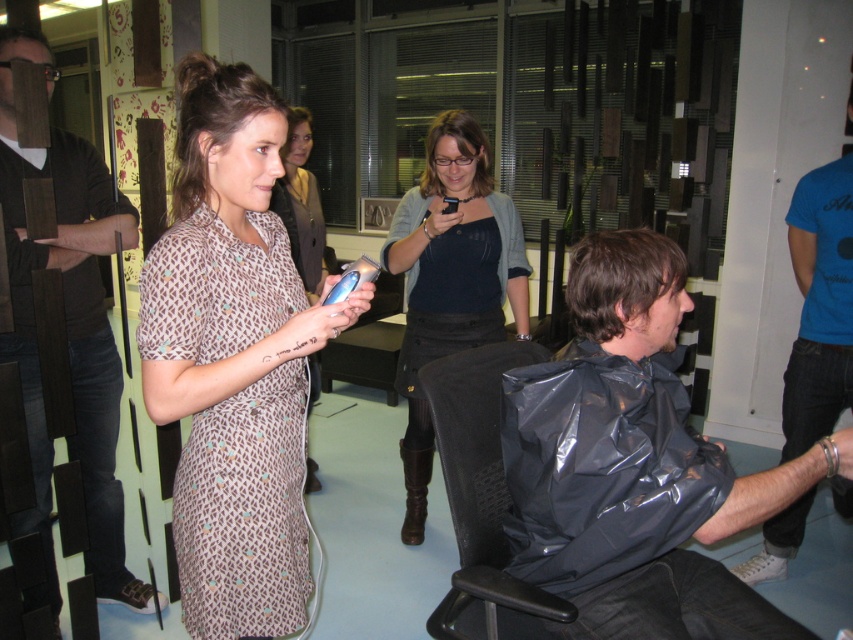
Question: Can you confirm if matte black shirt at center is smaller than dark blue jersey at center?

Choices:
 (A) no
 (B) yes

Answer: (A)

Question: Is blue cotton t-shirt at right above dark brown hair at right?

Choices:
 (A) yes
 (B) no

Answer: (B)

Question: Considering the real-world distances, which object is farthest from the matte black shirt at center?

Choices:
 (A) dark brown leather jacket at upper left
 (B) patterned fabric dress at center
 (C) dark blue jersey at center

Answer: (A)

Question: Which point is closer to the camera?

Choices:
 (A) [x=477, y=474]
 (B) [x=735, y=564]
 (C) [x=215, y=515]

Answer: (C)

Question: Which object is positioned closest to the blue cotton t-shirt at right?

Choices:
 (A) black plastic chair at center
 (B) brown printed fabric dress at center
 (C) matte black hair clipper at center
 (D) black mesh chair at lower center

Answer: (C)

Question: Is brown printed fabric dress at center smaller than brown textured hair at center?

Choices:
 (A) no
 (B) yes

Answer: (A)